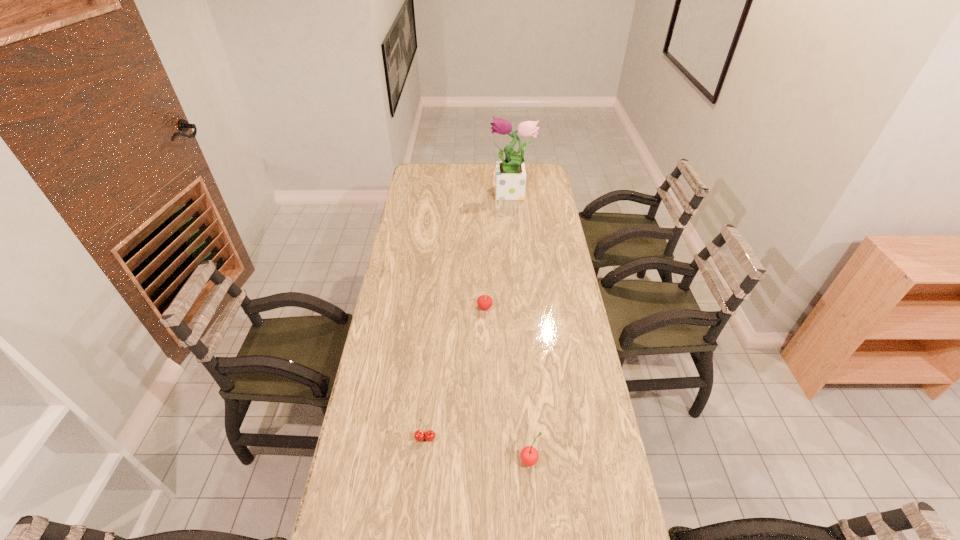
At what (x,y) coordinates should I click in order to perform the action: click on vacant space that's between the farthest object and the shortest object. Please return your answer as a coordinate pair (x, y). Looking at the image, I should click on (468, 316).

Point out which object is positioned as the second nearest to the flower arrangement. Please provide its 2D coordinates. Your answer should be formatted as a tuple, i.e. [(x, y)], where the tuple contains the x and y coordinates of a point satisfying the conditions above.

[(419, 435)]

You are a GUI agent. You are given a task and a screenshot of the screen. Output one action in this format:
    pyautogui.click(x=<x>, y=<y>)
    Task: Click on the object that is the second closest to the farthest cherry
    
    Given the screenshot: What is the action you would take?
    pyautogui.click(x=529, y=455)

I want to click on cherry that is the second nearest to the leftmost object, so click(x=484, y=302).

Identify the location of the closest cherry to the farthest cherry. (419, 435).

Find the location of `vacant point that satisfies the following two spatial constraints: 1. on the front-facing side of the farthest object; 2. on the front side of the nearest object`. vacant point that satisfies the following two spatial constraints: 1. on the front-facing side of the farthest object; 2. on the front side of the nearest object is located at coordinates (537, 460).

Locate an element on the screen. The height and width of the screenshot is (540, 960). free point that satisfies the following two spatial constraints: 1. on the front-facing side of the flower arrangement; 2. with the stems of the leftmost cherry pointing upwards is located at coordinates coord(534,438).

Where is `free spot that satisfies the following two spatial constraints: 1. on the front-facing side of the flower arrangement; 2. on the front side of the second farthest object`? The width and height of the screenshot is (960, 540). free spot that satisfies the following two spatial constraints: 1. on the front-facing side of the flower arrangement; 2. on the front side of the second farthest object is located at coordinates (522, 307).

This screenshot has height=540, width=960. I want to click on vacant space that satisfies the following two spatial constraints: 1. on the front-facing side of the flower arrangement; 2. with the stems of the leftmost cherry pointing upwards, so click(x=534, y=438).

Locate an element on the screen. The image size is (960, 540). free space that satisfies the following two spatial constraints: 1. with the stems of the nearest cherry pointing upwards; 2. on the right side of the shortest object is located at coordinates (423, 460).